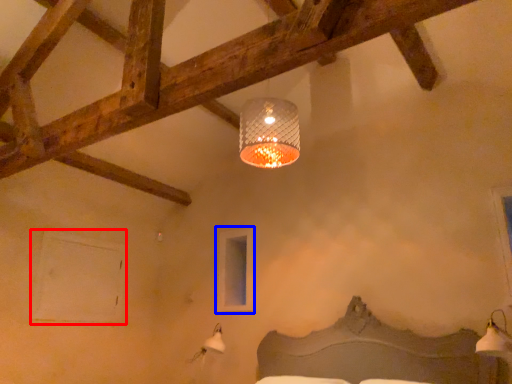
Question: Which of the following is the farthest to the observer, window (highlighted by a red box) or window (highlighted by a blue box)?

Choices:
 (A) window
 (B) window

Answer: (B)